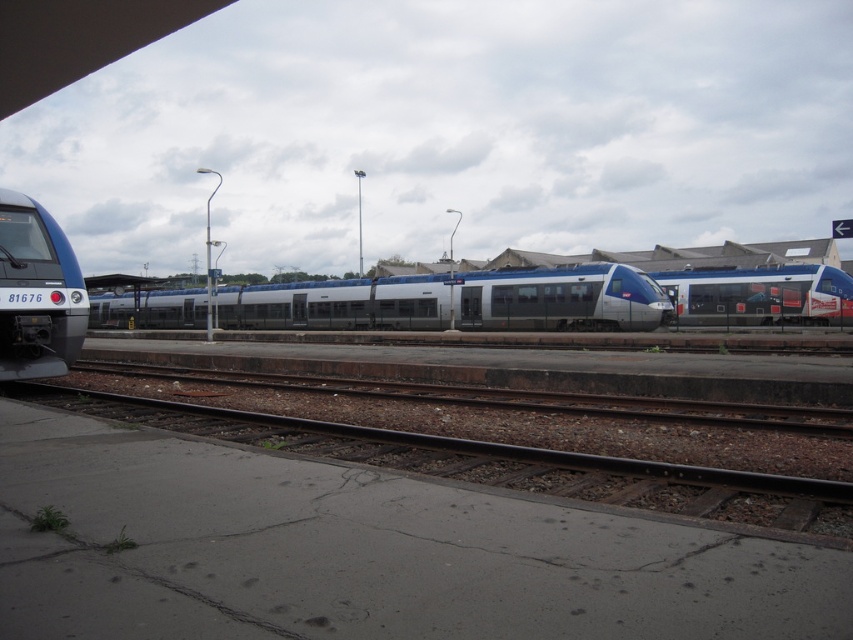
You are standing on the platform of the railway station depicted in the image. You notice a specific point marked at coordinates (x=38, y=292). What object is positioned at this point?

The blue glossy train at left is located at point (x=38, y=292).

You are a passenger waiting on the platform and see the blue glossy train at left and the silver metallic train at right. Which train is closer to the platform edge?

The blue glossy train at left is closer to the platform edge because it is positioned to the left of the silver metallic train at right, and the platform edge is on the left side of the tracks.